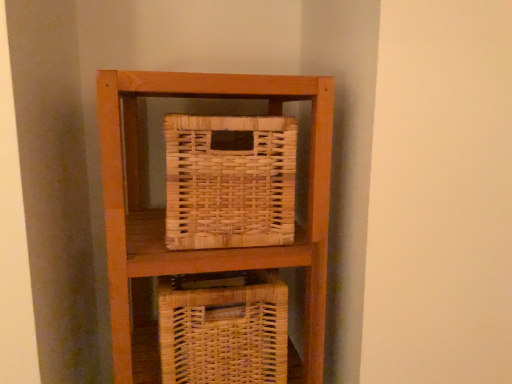
Question: Considering the positions of point (267, 218) and point (247, 375), is point (267, 218) closer or farther from the camera than point (247, 375)?

Choices:
 (A) closer
 (B) farther

Answer: (A)

Question: From the image's perspective, is natural wicker picnic basket at center above or below woven natural basket at center?

Choices:
 (A) above
 (B) below

Answer: (A)

Question: Based on their positions, is natural wicker picnic basket at center located to the left or right of woven natural basket at center?

Choices:
 (A) right
 (B) left

Answer: (A)

Question: Considering the positions of woven natural basket at center and natural wicker picnic basket at center in the image, is woven natural basket at center wider or thinner than natural wicker picnic basket at center?

Choices:
 (A) thin
 (B) wide

Answer: (B)

Question: Considering the positions of point (185, 322) and point (293, 163), is point (185, 322) closer or farther from the camera than point (293, 163)?

Choices:
 (A) farther
 (B) closer

Answer: (B)

Question: Is woven natural basket at center bigger or smaller than natural wicker picnic basket at center?

Choices:
 (A) big
 (B) small

Answer: (A)

Question: From the image's perspective, relative to natural wicker picnic basket at center, is woven natural basket at center above or below?

Choices:
 (A) above
 (B) below

Answer: (B)